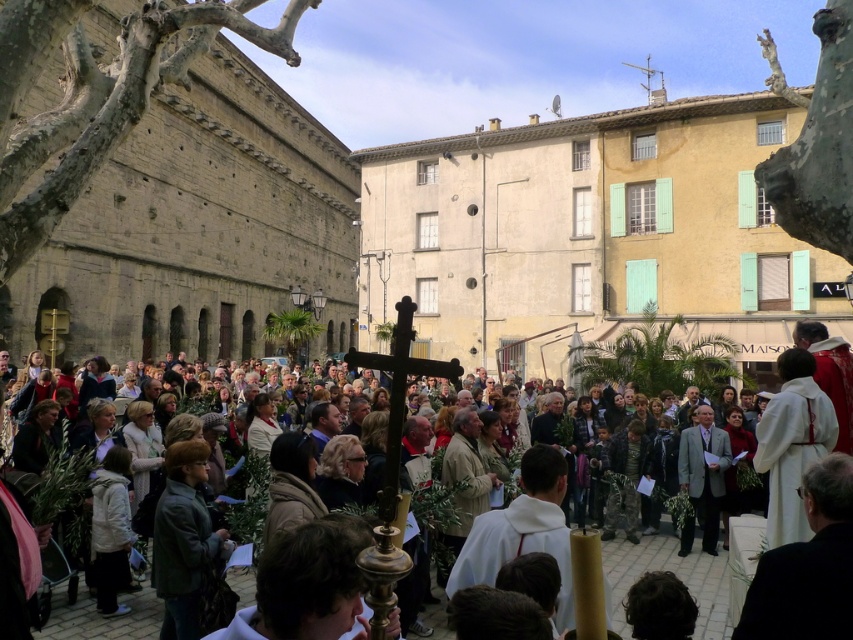
Between black matte robe at lower right and white cloth robe at lower right, which one has less height?

black matte robe at lower right is shorter.

Is point (851, 621) less distant than point (770, 435)?

Yes, it is in front of point (770, 435).

In order to click on black matte robe at lower right in this screenshot , I will do `click(801, 589)`.

Does gray stone church at left appear over gray wool suit at center?

Correct, gray stone church at left is located above gray wool suit at center.

The image size is (853, 640). What do you see at coordinates (200, 227) in the screenshot?
I see `gray stone church at left` at bounding box center [200, 227].

The width and height of the screenshot is (853, 640). Identify the location of gray stone church at left. (200, 227).

Describe the element at coordinates (590, 236) in the screenshot. I see `light beige stucco building at center` at that location.

Is point (479, 317) farther from camera compared to point (624, 556)?

Yes, point (479, 317) is behind point (624, 556).

Who is more forward, (457, 330) or (425, 620)?

Point (425, 620) is more forward.

This screenshot has height=640, width=853. Identify the location of light beige stucco building at center. (590, 236).